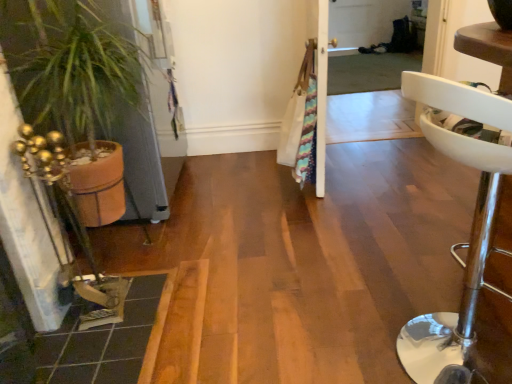
The width and height of the screenshot is (512, 384). Identify the location of unoccupied area behind white leather stool at right. (401, 272).